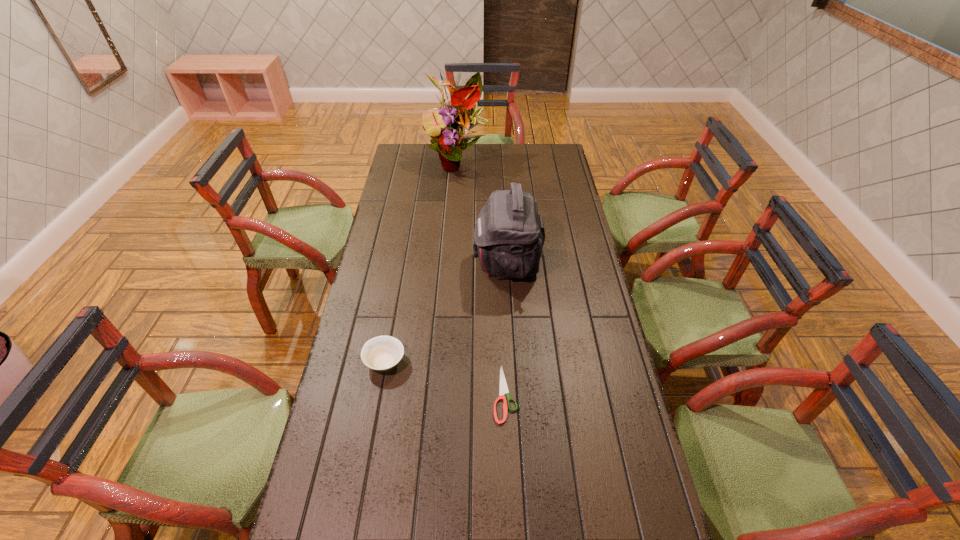
The image size is (960, 540). Identify the location of bouquet. (460, 118).

Where is `the tallest object`? the tallest object is located at coordinates 460,118.

At what (x,y) coordinates should I click in order to perform the action: click on the third nearest object. Please return your answer as a coordinate pair (x, y). Looking at the image, I should click on (509, 235).

Where is `the second tallest object`? the second tallest object is located at coordinates (509, 235).

The width and height of the screenshot is (960, 540). I want to click on the second shortest object, so click(381, 353).

In order to click on scissors in this screenshot , I will do `click(503, 385)`.

Identify the location of vacant space located on the front-facing side of the tallest object. [x=453, y=236].

What are the coordinates of `free location located on the open flap of the second farthest object` in the screenshot? It's located at (442, 262).

This screenshot has height=540, width=960. Find the location of `free location located 0.050m on the open flap of the second farthest object`. free location located 0.050m on the open flap of the second farthest object is located at coordinates (460, 262).

The height and width of the screenshot is (540, 960). What are the coordinates of `free space located on the open flap of the second farthest object` in the screenshot? It's located at (454, 262).